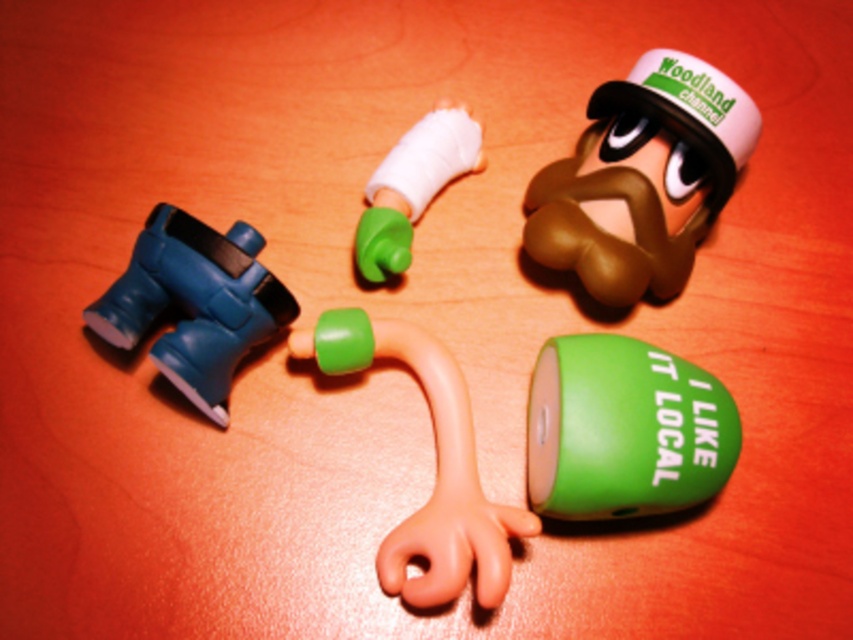
Who is more forward, (601, 188) or (462, 564)?

Point (462, 564) is more forward.

Can you confirm if green matte figure at upper center is taller than rubber hand at center?

Incorrect, green matte figure at upper center's height is not larger of rubber hand at center's.

I want to click on green matte figure at upper center, so click(643, 177).

Locate an element on the screen. The width and height of the screenshot is (853, 640). green matte figure at upper center is located at coordinates (643, 177).

Does green matte figure at upper center appear under blue rubber boots at left?

No, green matte figure at upper center is not below blue rubber boots at left.

Is point (630, 129) closer to viewer compared to point (206, 252)?

No, it is behind (206, 252).

Who is more forward, (x=640, y=282) or (x=183, y=355)?

Point (x=183, y=355)

This screenshot has width=853, height=640. Find the location of `green matte figure at upper center`. green matte figure at upper center is located at coordinates (643, 177).

Which of these two, green matte figure at upper center or green matte bandage at center, stands shorter?

green matte bandage at center

Is green matte figure at upper center shorter than green matte bandage at center?

Incorrect, green matte figure at upper center's height does not fall short of green matte bandage at center's.

Locate an element on the screen. The height and width of the screenshot is (640, 853). green matte figure at upper center is located at coordinates (643, 177).